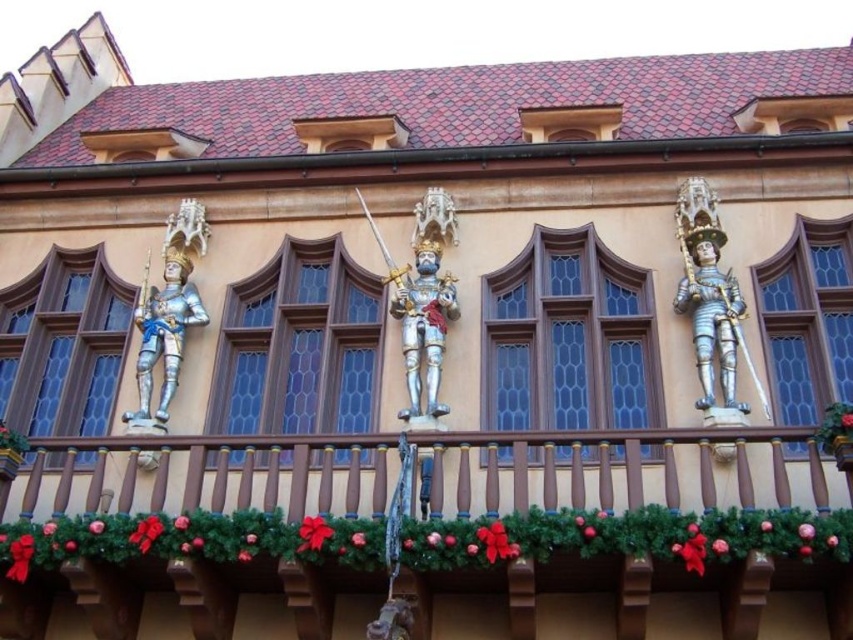
Question: Which point is farther from the camera taking this photo?

Choices:
 (A) (431, 202)
 (B) (537, 586)
 (C) (241, 401)

Answer: (A)

Question: Among these points, which one is farthest from the camera?

Choices:
 (A) (274, 273)
 (B) (26, 337)

Answer: (A)

Question: Which point appears farthest from the camera in this image?

Choices:
 (A) (27, 298)
 (B) (433, 586)

Answer: (A)

Question: Is blue glass window at center thinner than silver/golden metal knight at left?

Choices:
 (A) yes
 (B) no

Answer: (B)

Question: From the image, what is the correct spatial relationship of brown wood window at left in relation to blue metallic knight at center?

Choices:
 (A) right
 (B) left

Answer: (B)

Question: Does blue glass window at center have a lesser width compared to clear glass window at center?

Choices:
 (A) no
 (B) yes

Answer: (A)